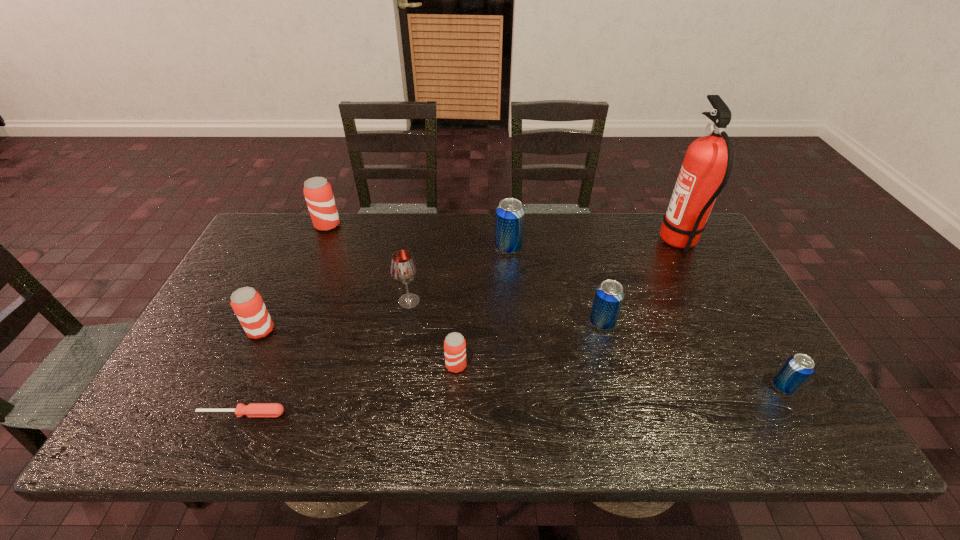
Locate an element on the screen. The width and height of the screenshot is (960, 540). beer can that is at the left edge is located at coordinates (246, 302).

You are a GUI agent. You are given a task and a screenshot of the screen. Output one action in this format:
    pyautogui.click(x=<x>, y=<y>)
    Task: Click on the screwdriver at the left edge
    The image size is (960, 540).
    Given the screenshot: What is the action you would take?
    pyautogui.click(x=253, y=409)

Find the location of a particular element. fire extinguisher situated at the right edge is located at coordinates (706, 168).

Where is `beer can situated at the right edge`? This screenshot has width=960, height=540. beer can situated at the right edge is located at coordinates coord(797,369).

The width and height of the screenshot is (960, 540). In order to click on object at the near left corner in this screenshot , I will do `click(253, 409)`.

In order to click on object present at the far right corner in this screenshot , I will do pos(706,168).

In the image, there is a desktop. Find the location of `vacant space at the far edge`. vacant space at the far edge is located at coordinates (496, 258).

In the image, there is a desktop. At what (x,y) coordinates should I click in order to perform the action: click on vacant space at the near edge. Please return your answer as a coordinate pair (x, y). Image resolution: width=960 pixels, height=540 pixels. Looking at the image, I should click on (417, 437).

Where is `vacant space at the left edge`? vacant space at the left edge is located at coordinates (229, 343).

Locate an element on the screen. vacant space at the right edge of the desktop is located at coordinates (701, 264).